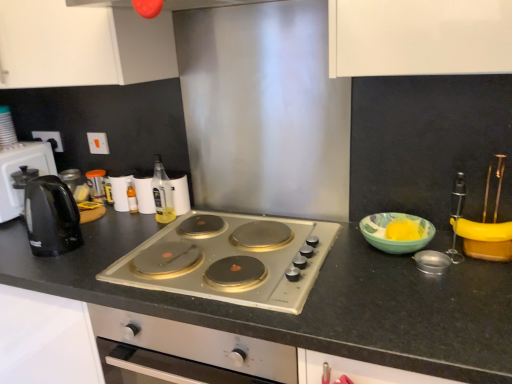
Question: Can you confirm if white matte cabinet at upper left is wider than black granite countertop at center?

Choices:
 (A) yes
 (B) no

Answer: (B)

Question: Considering the relative positions of white matte cabinet at upper left and black granite countertop at center in the image provided, is white matte cabinet at upper left to the left of black granite countertop at center from the viewer's perspective?

Choices:
 (A) no
 (B) yes

Answer: (B)

Question: Is white matte cabinet at upper left turned away from black granite countertop at center?

Choices:
 (A) yes
 (B) no

Answer: (B)

Question: Does white matte cabinet at upper left have a smaller size compared to black granite countertop at center?

Choices:
 (A) no
 (B) yes

Answer: (B)

Question: Would you say white matte cabinet at upper left contains black granite countertop at center?

Choices:
 (A) yes
 (B) no

Answer: (B)

Question: Is white matte cabinet at upper left in front of black granite countertop at center?

Choices:
 (A) yes
 (B) no

Answer: (B)

Question: From the image's perspective, is black plastic kettle at left located above black granite countertop at center?

Choices:
 (A) no
 (B) yes

Answer: (B)

Question: From the image's perspective, would you say black plastic kettle at left is shown under black granite countertop at center?

Choices:
 (A) yes
 (B) no

Answer: (B)

Question: Can you confirm if black plastic kettle at left is thinner than black granite countertop at center?

Choices:
 (A) yes
 (B) no

Answer: (A)

Question: Can you confirm if black plastic kettle at left is smaller than black granite countertop at center?

Choices:
 (A) no
 (B) yes

Answer: (B)

Question: Is black plastic kettle at left placed right next to black granite countertop at center?

Choices:
 (A) no
 (B) yes

Answer: (A)

Question: Considering the relative sizes of black plastic kettle at left and black granite countertop at center in the image provided, is black plastic kettle at left wider than black granite countertop at center?

Choices:
 (A) yes
 (B) no

Answer: (B)

Question: Considering the relative sizes of translucent glass bottle at center, the 1th bottle positioned from the left, and black granite countertop at center in the image provided, is translucent glass bottle at center, the 1th bottle positioned from the left, bigger than black granite countertop at center?

Choices:
 (A) no
 (B) yes

Answer: (A)